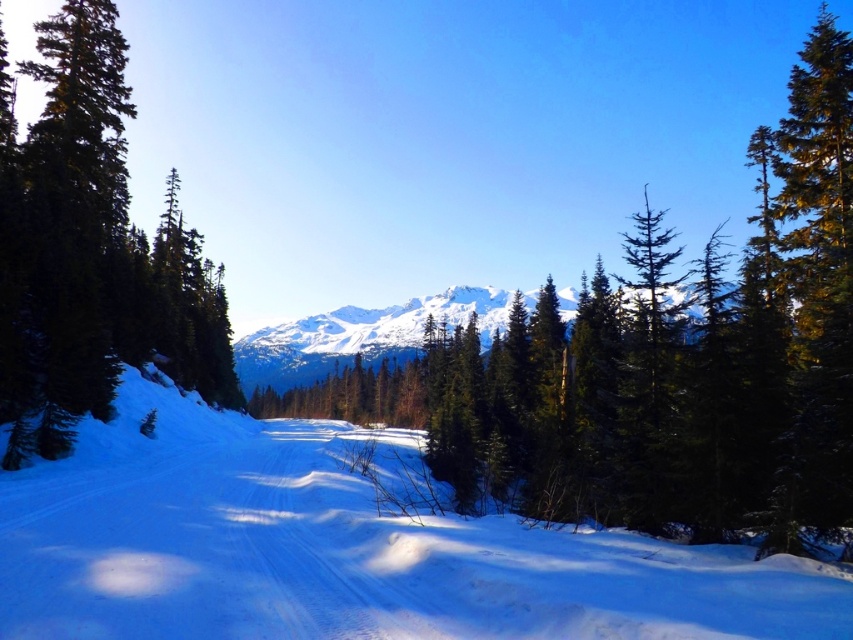
Identify the location of white snow ski slope at center. This screenshot has height=640, width=853. (344, 548).

Does white snow ski slope at center have a lesser width compared to white snow-covered mountain at center?

Yes, white snow ski slope at center is thinner than white snow-covered mountain at center.

Is point (691, 592) farther from viewer compared to point (403, 332)?

No, (691, 592) is in front of (403, 332).

Image resolution: width=853 pixels, height=640 pixels. I want to click on white snow ski slope at center, so click(x=344, y=548).

Is white snow ski slope at center positioned behind green matte tree at left?

No, it is in front of green matte tree at left.

Does point (247, 515) come in front of point (74, 358)?

Yes, point (247, 515) is closer to viewer.

The width and height of the screenshot is (853, 640). In order to click on white snow ski slope at center in this screenshot , I will do `click(344, 548)`.

Does point (144, 256) lie in front of point (241, 340)?

Yes, point (144, 256) is in front of point (241, 340).

Does green matte tree at left come behind white snow-covered mountain at center?

No, it is not.

Is point (62, 68) positioned after point (532, 294)?

No, (62, 68) is closer to viewer.

Where is `green matte tree at left`? green matte tree at left is located at coordinates point(91,252).